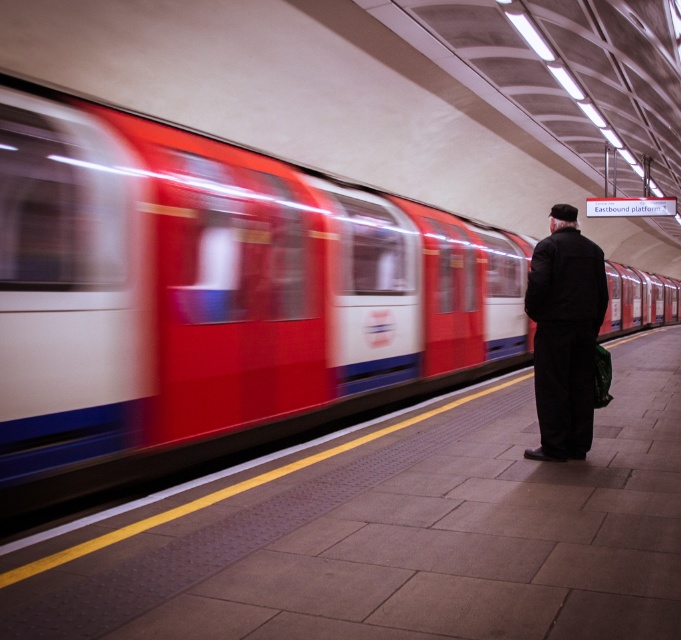
You are a photographer trying to capture a photo of the white glossy train at center and the dark woolen coat at center. Based on their sizes, which one should you focus on to ensure it appears more prominent in the photo?

The white glossy train at center is larger in size than the dark woolen coat at center, so focusing on the white glossy train at center will make it appear more prominent in the photo.

You are a passenger on the Eastbound platform at a London Underground station. You see the white glossy train at center and the dark woolen coat at center. Which object is higher in position?

The white glossy train at center is above the dark woolen coat at center, so the white glossy train at center is higher in position.